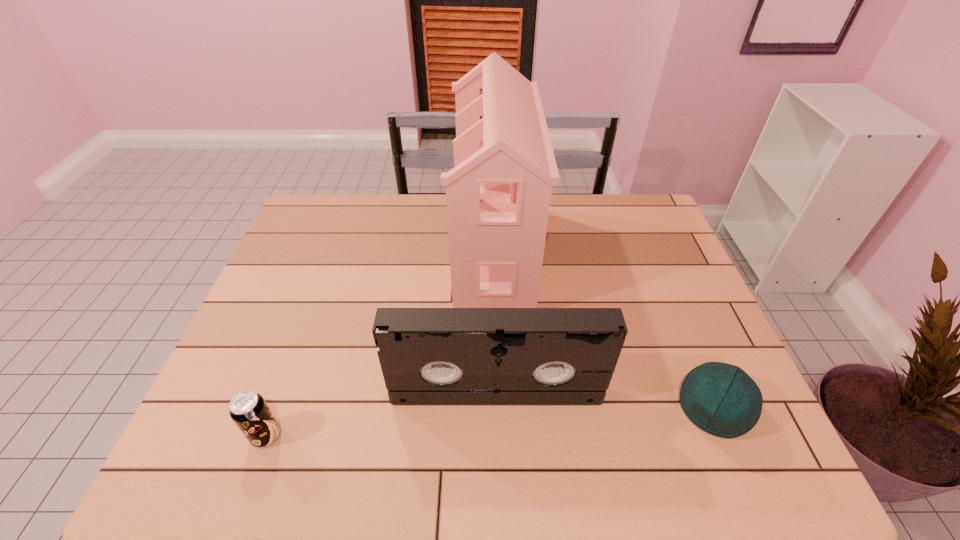
Locate an element on the screen. vacant position located on the back of the beanie is located at coordinates (672, 308).

At what (x,y) coordinates should I click in order to perform the action: click on object present at the far edge. Please return your answer as a coordinate pair (x, y). This screenshot has width=960, height=540. Looking at the image, I should click on (498, 194).

At what (x,y) coordinates should I click in order to perform the action: click on soda can that is positioned at the near edge. Please return your answer as a coordinate pair (x, y). The width and height of the screenshot is (960, 540). Looking at the image, I should click on (249, 411).

Locate an element on the screen. This screenshot has height=540, width=960. beanie that is at the near edge is located at coordinates (721, 399).

You are a GUI agent. You are given a task and a screenshot of the screen. Output one action in this format:
    pyautogui.click(x=<x>, y=<y>)
    Task: Click on the object that is positioned at the left edge
    The image size is (960, 540).
    Given the screenshot: What is the action you would take?
    pyautogui.click(x=249, y=411)

Find the location of `object present at the right edge`. object present at the right edge is located at coordinates (721, 399).

This screenshot has width=960, height=540. Identify the location of object located at the near left corner. (249, 411).

This screenshot has height=540, width=960. Find the location of `object located at the near right corner`. object located at the near right corner is located at coordinates (721, 399).

Where is `free spot at the far edge of the desktop`? The height and width of the screenshot is (540, 960). free spot at the far edge of the desktop is located at coordinates (394, 225).

The image size is (960, 540). In the image, there is a desktop. What are the coordinates of `vacant area at the left edge` in the screenshot? It's located at (288, 343).